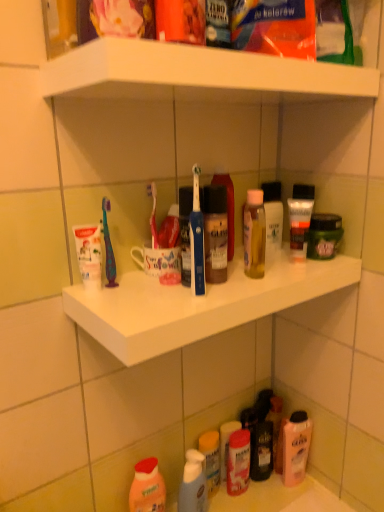
This screenshot has height=512, width=384. Find the location of `blank space to the left of matte white tube at upper right, which is the 4th toiletry from left to right`. blank space to the left of matte white tube at upper right, which is the 4th toiletry from left to right is located at coordinates (266, 267).